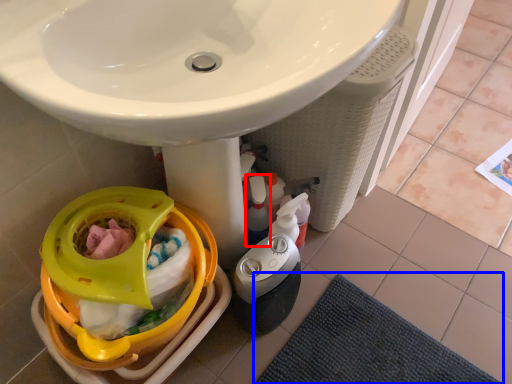
Question: Which point is closer to the camera, cleaning product (highlighted by a red box) or bath mat (highlighted by a blue box)?

Choices:
 (A) cleaning product
 (B) bath mat

Answer: (B)